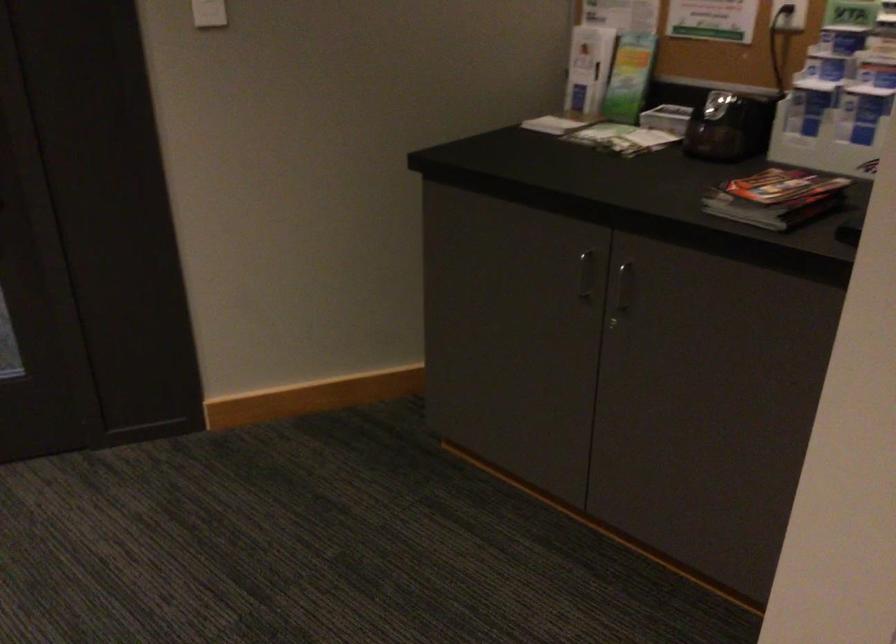
I want to click on white light switch, so click(x=209, y=13).